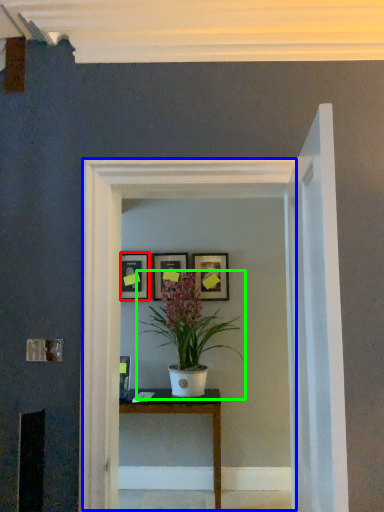
Question: Which object is the closest to the picture frame (highlighted by a red box)? Choose among these: glass door (highlighted by a blue box) or houseplant (highlighted by a green box).

Choices:
 (A) glass door
 (B) houseplant

Answer: (B)